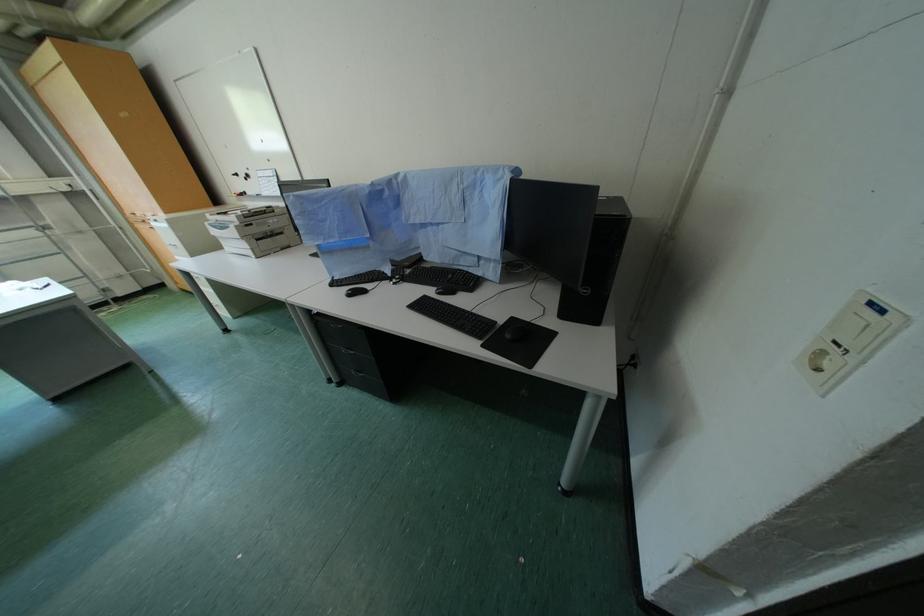
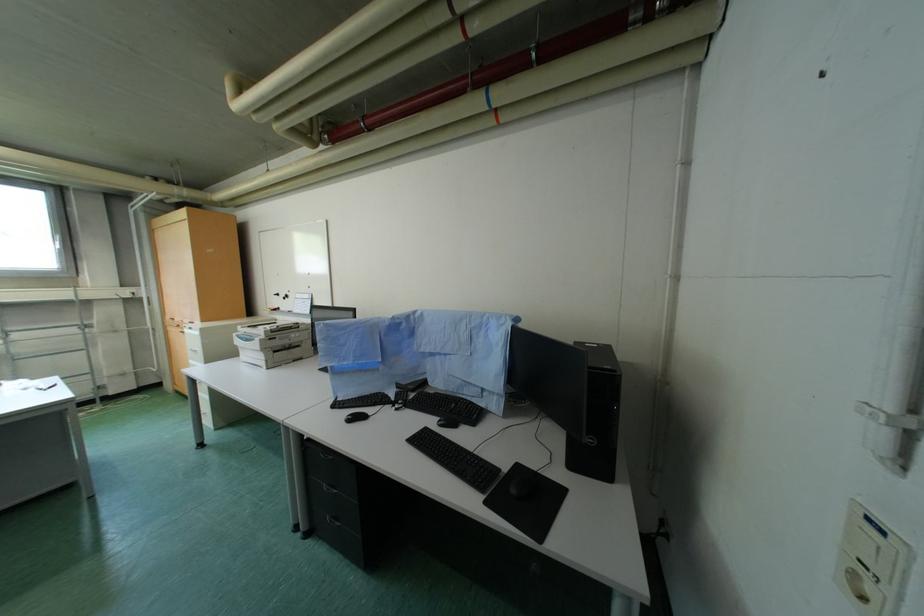
Question: Based on the continuous images, in which direction is the camera rotating? Reply with the corresponding letter.

Choices:
 (A) Left
 (B) Right
 (C) Up
 (D) Down

Answer: (C)